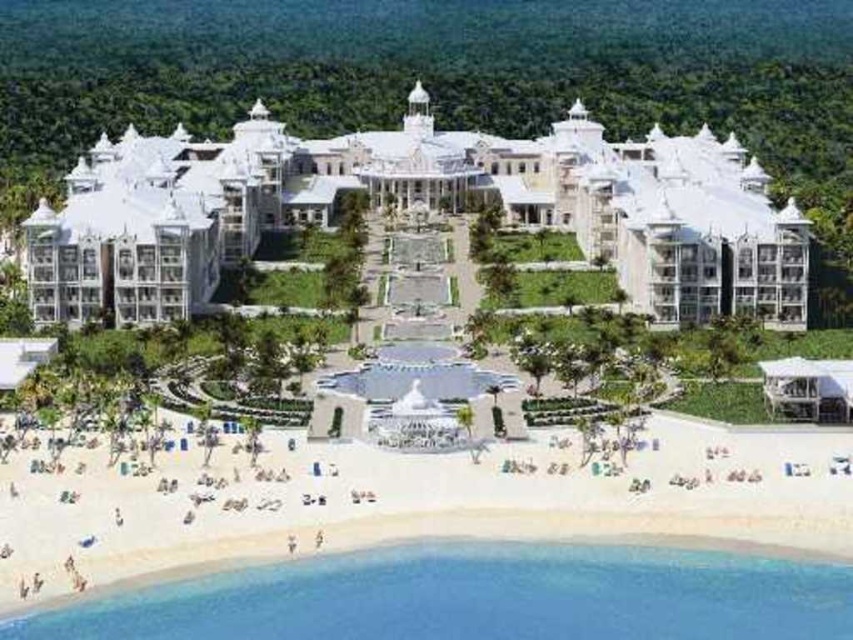
Question: Which object is farther from the camera taking this photo?

Choices:
 (A) white glossy resort at center
 (B) white sand beach at lower left

Answer: (A)

Question: Can you confirm if white glossy resort at center is positioned above white sand beach at lower left?

Choices:
 (A) no
 (B) yes

Answer: (B)

Question: Is white glossy resort at center in front of white sand beach at lower left?

Choices:
 (A) yes
 (B) no

Answer: (B)

Question: Can you confirm if white glossy resort at center is smaller than white sand beach at lower left?

Choices:
 (A) yes
 (B) no

Answer: (B)